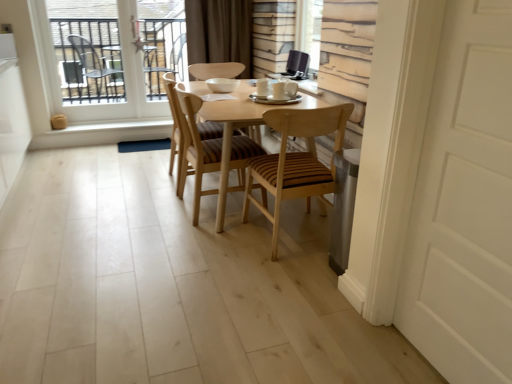
Question: In the image, is wooden striped chair at center, the 1th chair when ordered from right to left, positioned in front of or behind wooden slats at upper center?

Choices:
 (A) behind
 (B) front

Answer: (B)

Question: Considering the positions of point (279, 117) and point (314, 33), is point (279, 117) closer or farther from the camera than point (314, 33)?

Choices:
 (A) closer
 (B) farther

Answer: (A)

Question: Which of these objects is positioned farthest from the clear glass window at upper left?

Choices:
 (A) brown fabric curtain at upper center
 (B) white matte door at center
 (C) wooden slats at upper center
 (D) wooden at center, which is the 1th chair from left to right
 (E) woodenchair at center, the 2th chair from the right

Answer: (B)

Question: Which of these objects is positioned closest to the wooden table at center?

Choices:
 (A) clear glass window at upper left
 (B) wooden slats at upper center
 (C) wooden striped chair at center, the 1th chair when ordered from right to left
 (D) wooden at center, which is the 1th chair from left to right
 (E) brown fabric curtain at upper center

Answer: (C)